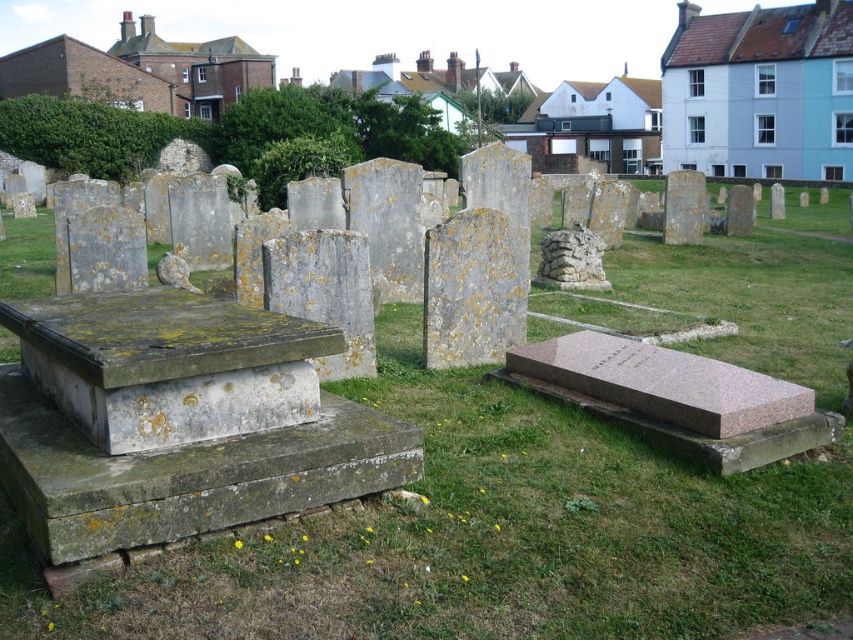
Question: Which object is farther from the camera taking this photo?

Choices:
 (A) green mossy grass at center
 (B) green mossy stone at center

Answer: (B)

Question: Is green mossy grass at center below green mossy stone at center?

Choices:
 (A) no
 (B) yes

Answer: (A)

Question: Which object appears farthest from the camera in this image?

Choices:
 (A) green mossy stone at center
 (B) green mossy grass at center

Answer: (A)

Question: Among these objects, which one is farthest from the camera?

Choices:
 (A) green mossy stone at center
 (B) green mossy grass at center

Answer: (A)

Question: Is green mossy grass at center bigger than green mossy stone at center?

Choices:
 (A) yes
 (B) no

Answer: (A)

Question: Can you confirm if green mossy grass at center is positioned to the right of green mossy stone at center?

Choices:
 (A) yes
 (B) no

Answer: (B)